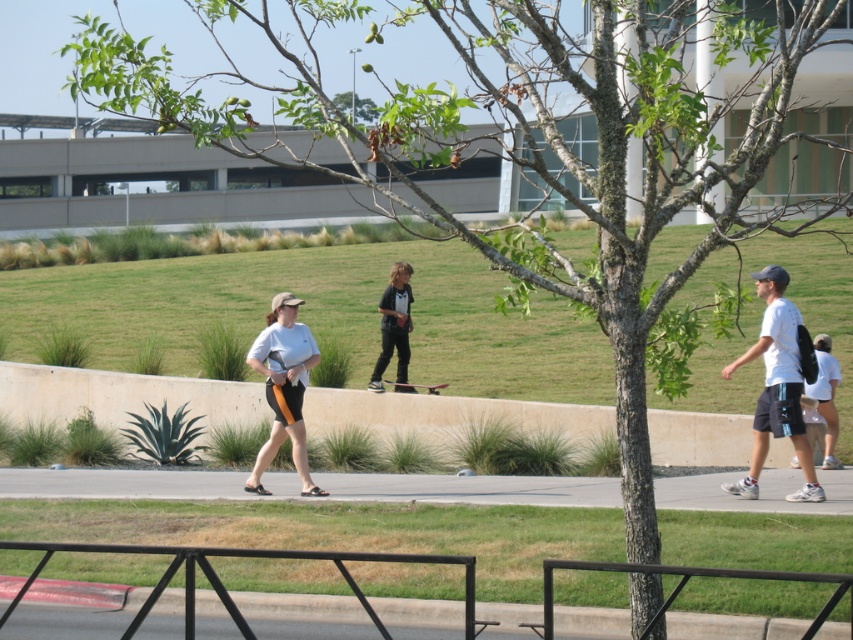
Is black metal rail at lower center positioned before dark red wood skateboard at center?

Yes, black metal rail at lower center is closer to the viewer.

Is point (268, 556) positioned behind point (384, 381)?

No, it is not.

The width and height of the screenshot is (853, 640). Find the location of `black metal rail at lower center`. black metal rail at lower center is located at coordinates (241, 556).

Does black metal rail at lower center have a smaller size compared to white matte t-shirt at right?

Yes.

Is black metal rail at lower center shorter than white matte t-shirt at right?

Yes, black metal rail at lower center is shorter than white matte t-shirt at right.

The image size is (853, 640). Describe the element at coordinates (241, 556) in the screenshot. I see `black metal rail at lower center` at that location.

In order to click on black metal rail at lower center in this screenshot , I will do `click(241, 556)`.

Does white matte shorts at center appear under black matte skateboard at center?

Yes.

Can you confirm if white matte shorts at center is smaller than black matte skateboard at center?

Yes, white matte shorts at center is smaller than black matte skateboard at center.

This screenshot has width=853, height=640. In order to click on white matte shorts at center in this screenshot , I will do `click(283, 387)`.